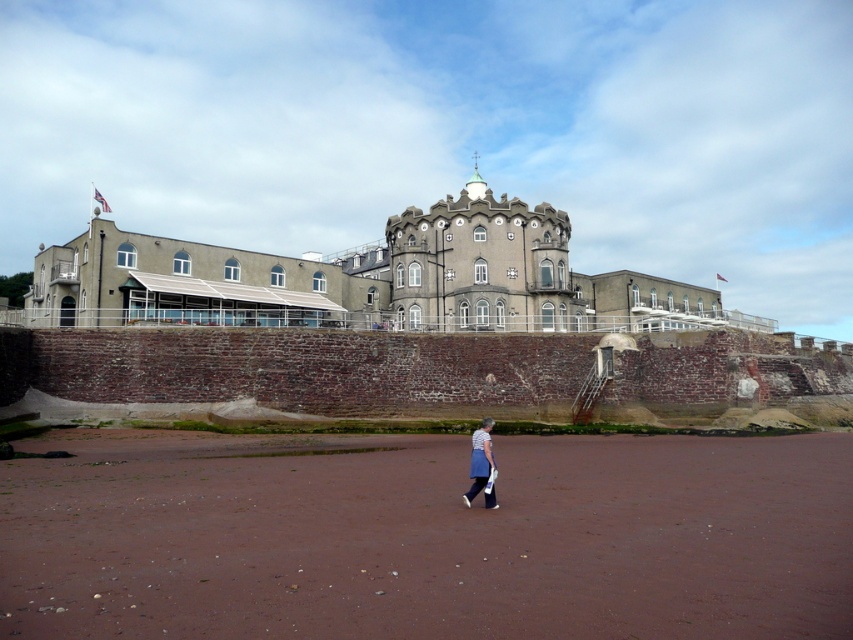
You are standing at the base of the building and want to walk towards the entrance. There are two points marked on the ground in front of you. The first point is labeled as point (334, 291), and the second is point (485, 461). Which point is closer to the building?

Point (334, 291) is behind point (485, 461), so the point closer to the building is point (485, 461).

You are standing in front of the building and want to take a photo that includes both the gray stone castle at center and the blue denim skirt at lower center. Which object will appear larger in the photo?

The gray stone castle at center will appear larger in the photo because it is much taller than the blue denim skirt at lower center.